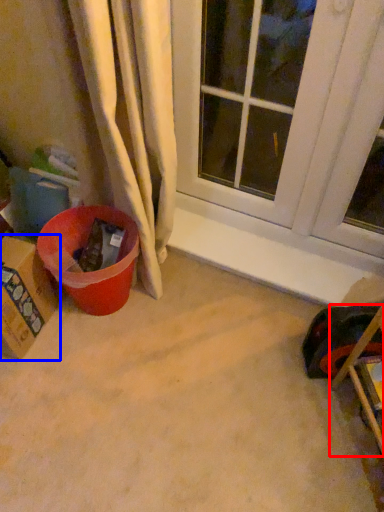
Question: Which object is further to the camera taking this photo, furniture (highlighted by a red box) or cardboard box (highlighted by a blue box)?

Choices:
 (A) furniture
 (B) cardboard box

Answer: (B)